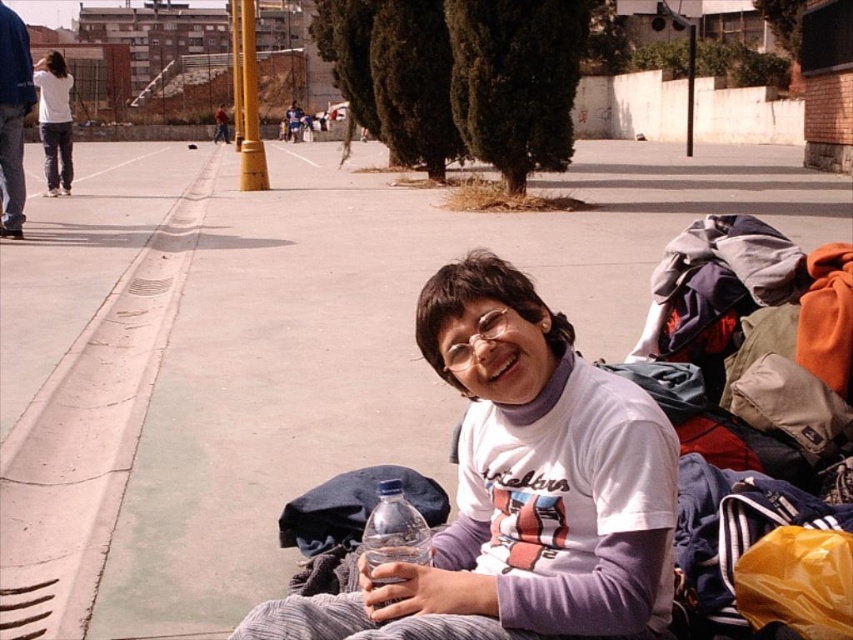
Which is more to the right, white matte t-shirt at center or brown leather jacket at upper center?

white matte t-shirt at center

Does white matte t-shirt at center appear on the left side of brown leather jacket at upper center?

No, white matte t-shirt at center is not to the left of brown leather jacket at upper center.

Between point (654, 632) and point (222, 120), which one is positioned behind?

Point (222, 120)

Where is `white matte t-shirt at center`? This screenshot has height=640, width=853. white matte t-shirt at center is located at coordinates (520, 488).

Consider the image. Can you confirm if white matte t-shirt at center is smaller than matte white shirt at upper left?

Correct, white matte t-shirt at center occupies less space than matte white shirt at upper left.

Which of these two, white matte t-shirt at center or matte white shirt at upper left, stands shorter?

With less height is white matte t-shirt at center.

Who is more distant from viewer, (x=238, y=625) or (x=49, y=74)?

Positioned behind is point (x=49, y=74).

The height and width of the screenshot is (640, 853). What are the coordinates of `white matte t-shirt at center` in the screenshot? It's located at [520, 488].

Is white matte t-shirt at center to the left of concrete at left from the viewer's perspective?

Incorrect, white matte t-shirt at center is not on the left side of concrete at left.

Is point (473, 435) positioned in front of point (149, 307)?

Yes, it is.

Identify the location of white matte t-shirt at center. (520, 488).